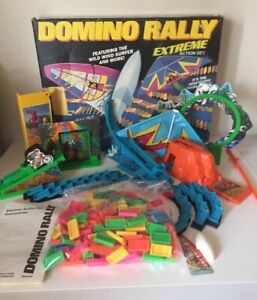
The width and height of the screenshot is (257, 300). I want to click on white table top surface, so click(x=231, y=293), click(x=249, y=152), click(x=11, y=157).